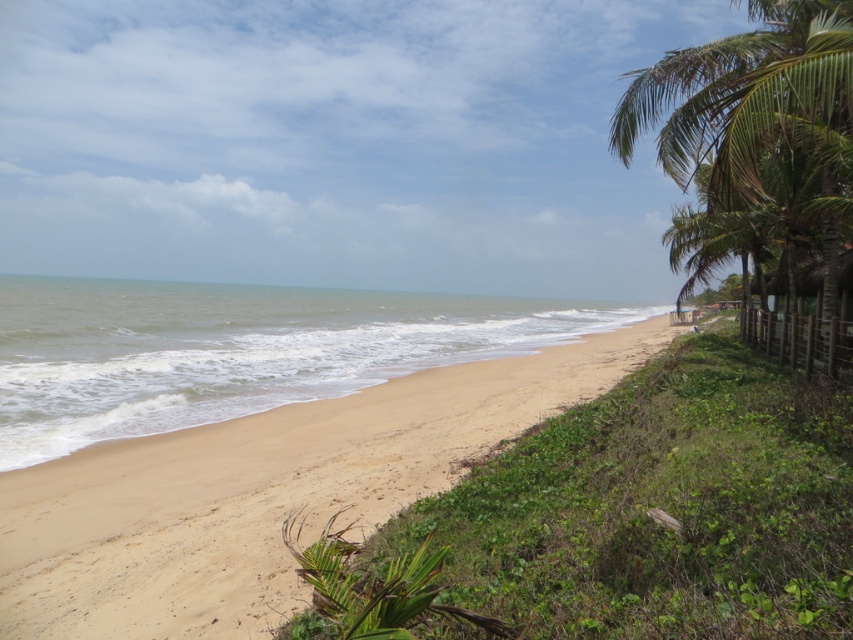
Question: Considering the relative positions of light brown sand at center and green leafy palm tree at right in the image provided, where is light brown sand at center located with respect to green leafy palm tree at right?

Choices:
 (A) above
 (B) below

Answer: (B)

Question: Can you confirm if light brown sand at center is bigger than green leafy palm tree at right?

Choices:
 (A) yes
 (B) no

Answer: (B)

Question: Among these points, which one is farthest from the camera?

Choices:
 (A) (830, 252)
 (B) (519, 387)

Answer: (B)

Question: Among these points, which one is farthest from the camera?

Choices:
 (A) (787, 260)
 (B) (312, 449)

Answer: (A)

Question: Does light brown sand at center have a greater width compared to green leafy palm tree at right?

Choices:
 (A) yes
 (B) no

Answer: (B)

Question: Among these objects, which one is nearest to the camera?

Choices:
 (A) green leafy palm tree at right
 (B) light brown sand at center

Answer: (B)